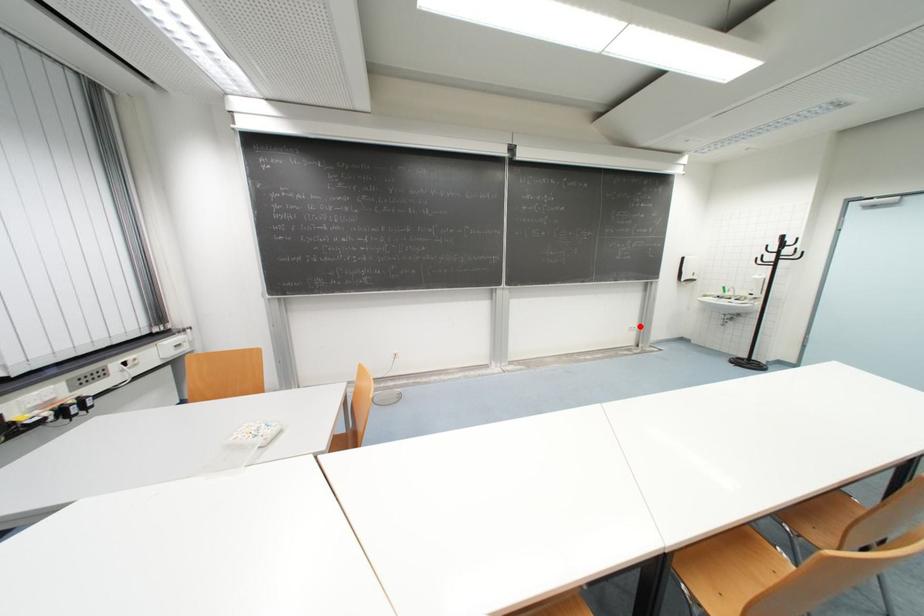
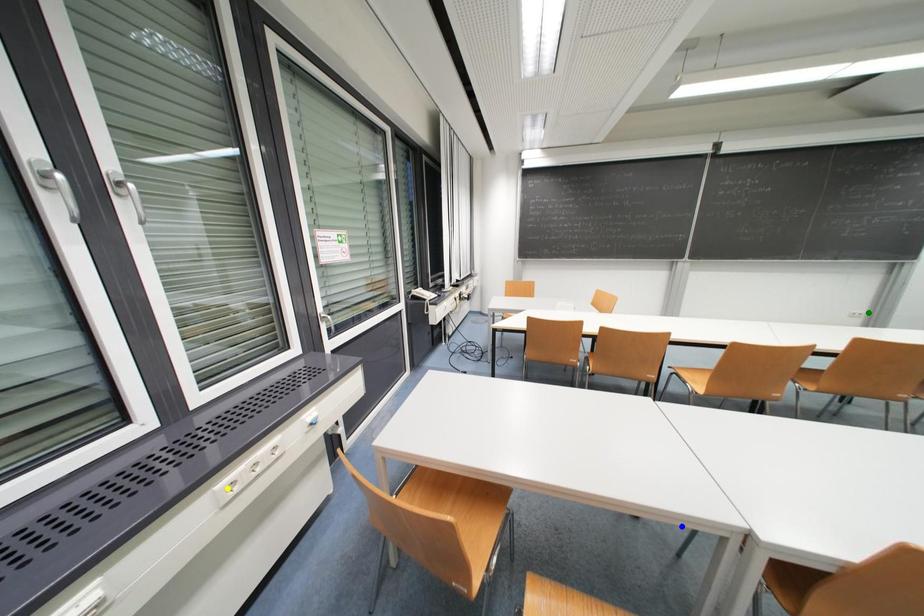
Question: I am providing you with two images of the same scene from different viewpoints. A red point is marked on the first image. You are given multiple points on the second image. In image 2, which mark is for the same physical point as the one in image 1?

Choices:
 (A) yellow point
 (B) green point
 (C) blue point

Answer: (B)